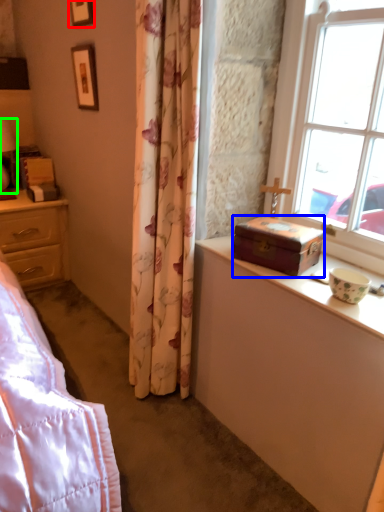
Question: Which is farther away from picture frame (highlighted by a red box)? box (highlighted by a blue box) or table lamp (highlighted by a green box)?

Choices:
 (A) box
 (B) table lamp

Answer: (A)